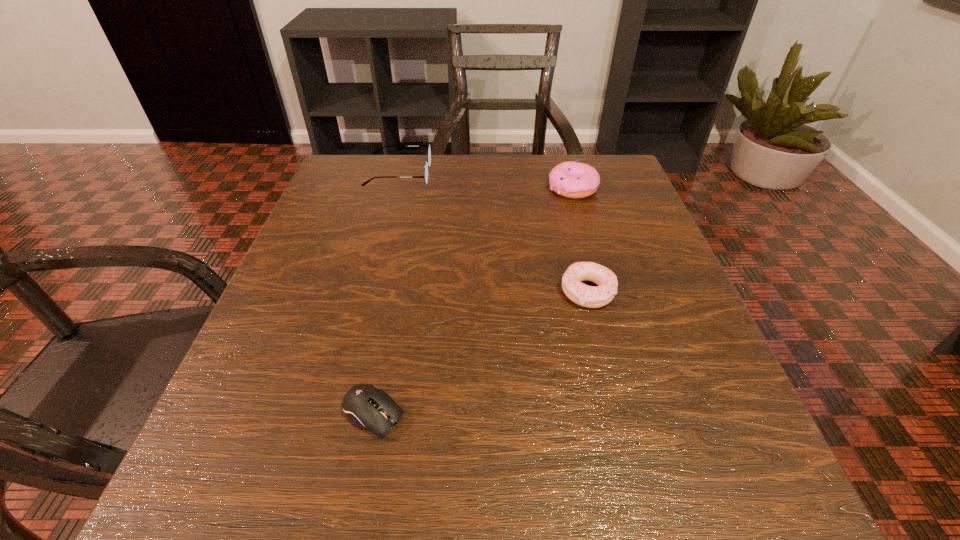
Where is `the third closest object to the farther doughnut`? The image size is (960, 540). the third closest object to the farther doughnut is located at coordinates (366, 406).

Select which object appears as the second closest to the spectacles. Please provide its 2D coordinates. Your answer should be formatted as a tuple, i.e. [(x, y)], where the tuple contains the x and y coordinates of a point satisfying the conditions above.

[(587, 296)]

Image resolution: width=960 pixels, height=540 pixels. Identify the location of vacant region that satisfies the following two spatial constraints: 1. on the lenses of the farther doughnut; 2. on the left side of the spectacles. (396, 188).

Where is `free region that satisfies the following two spatial constraints: 1. on the lenses of the spectacles; 2. on the right side of the second nearest object`? free region that satisfies the following two spatial constraints: 1. on the lenses of the spectacles; 2. on the right side of the second nearest object is located at coordinates (369, 292).

Image resolution: width=960 pixels, height=540 pixels. What are the coordinates of `vacant space that satisfies the following two spatial constraints: 1. on the lenses of the spectacles; 2. on the left side of the computer mouse` in the screenshot? It's located at [337, 414].

Identify the location of free space that satisfies the following two spatial constraints: 1. on the lenses of the spectacles; 2. on the left side of the farther doughnut. This screenshot has height=540, width=960. (396, 188).

You are a GUI agent. You are given a task and a screenshot of the screen. Output one action in this format:
    pyautogui.click(x=<x>, y=<y>)
    Task: Click on the free space that satisfies the following two spatial constraints: 1. on the back side of the nearest object; 2. on the lenses of the spectacles
    Image resolution: width=960 pixels, height=540 pixels.
    Given the screenshot: What is the action you would take?
    pyautogui.click(x=420, y=174)

Where is `free space that satisfies the following two spatial constraints: 1. on the back side of the shorter doughnut; 2. on the right side of the nearest object`? free space that satisfies the following two spatial constraints: 1. on the back side of the shorter doughnut; 2. on the right side of the nearest object is located at coordinates (397, 292).